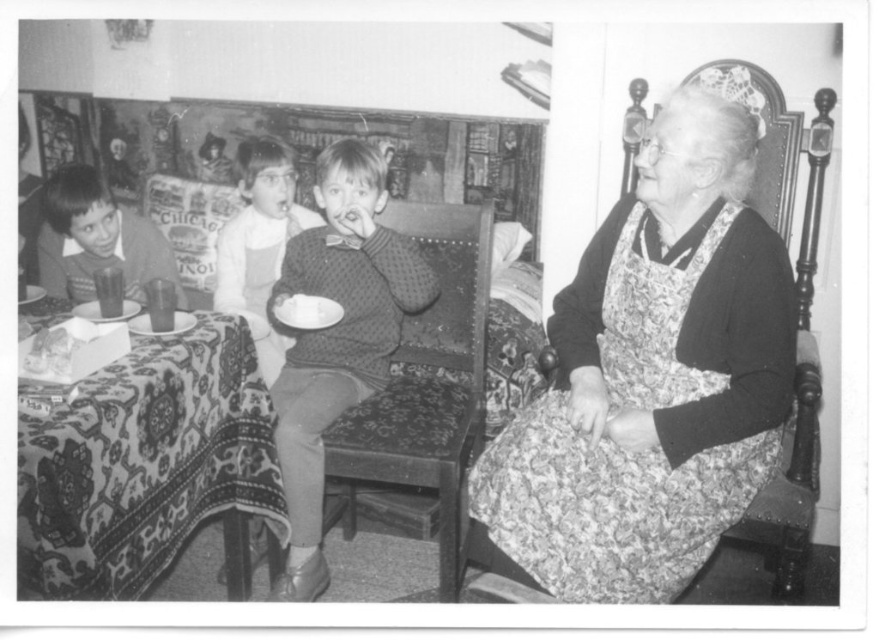
You are a guest at this vintage dining scene and notice both the knitted sweater at center and the white fluffy cake at center. Which object is closer to you?

The knitted sweater at center is closer to you because it is in front of the white fluffy cake at center.